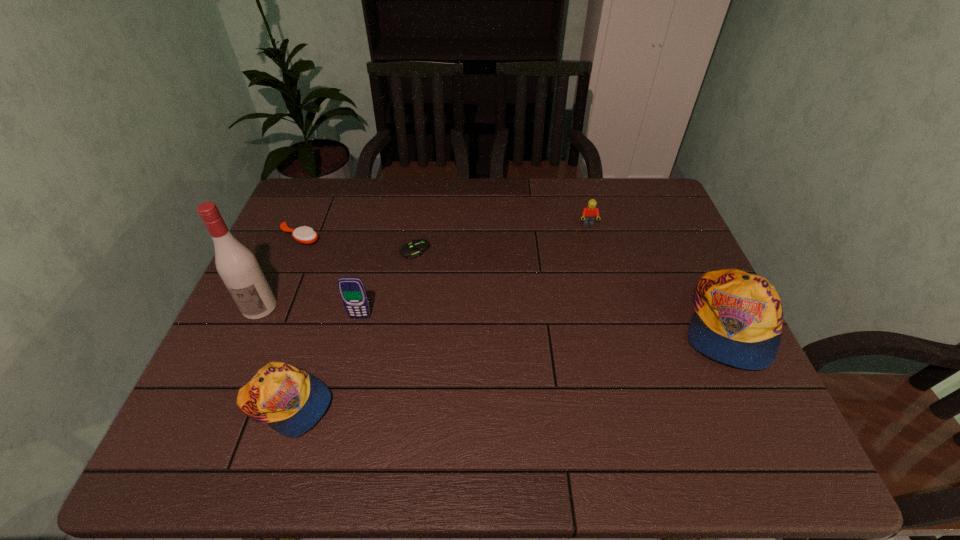
This screenshot has width=960, height=540. Identify the location of free region located on the bill of the rightmost object. (767, 404).

This screenshot has height=540, width=960. I want to click on vacant space located 0.080m on the back of the shortest object, so click(419, 225).

I want to click on free point located 0.270m on the back of the sixth tallest object, so 325,179.

Find the location of a particular element. vacant space located on the face of the sixth object from left to right is located at coordinates (597, 260).

Find the location of a particular element. The width and height of the screenshot is (960, 540). vacant region located 0.250m on the label of the alcohol is located at coordinates (212, 413).

Find the location of a particular element. vacant space located on the front-facing side of the cellular telephone is located at coordinates pyautogui.click(x=354, y=342).

Identify the location of object that is at the near edge. point(290,400).

In order to click on cap that is at the left edge in this screenshot , I will do `click(290, 400)`.

Locate an element on the screen. hairbrush situated at the left edge is located at coordinates (306, 235).

Locate an element on the screen. The image size is (960, 540). alcohol located at the left edge is located at coordinates (237, 266).